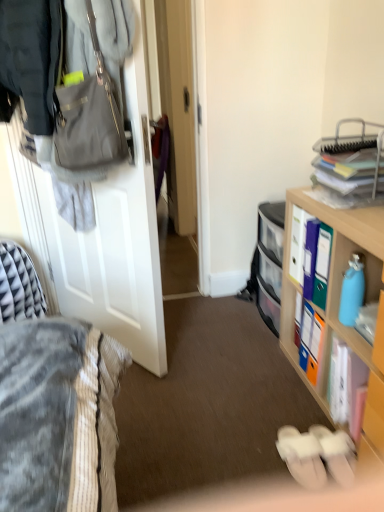
The width and height of the screenshot is (384, 512). In order to click on vacant space behind white fabric slippers at lower center, positioned as the second footwear in left-to-right order in this screenshot , I will do `click(302, 413)`.